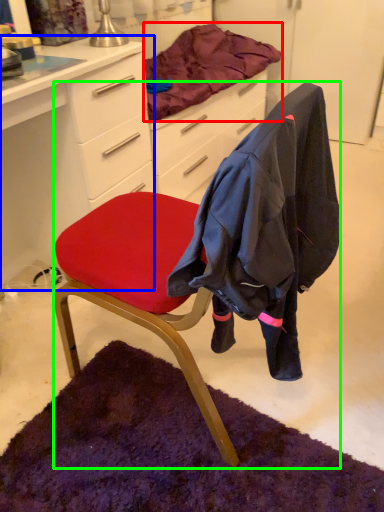
Question: Estimate the real-world distances between objects in this image. Which object is closer to blanket (highlighted by a red box), desk (highlighted by a blue box) or chair (highlighted by a green box)?

Choices:
 (A) desk
 (B) chair

Answer: (A)